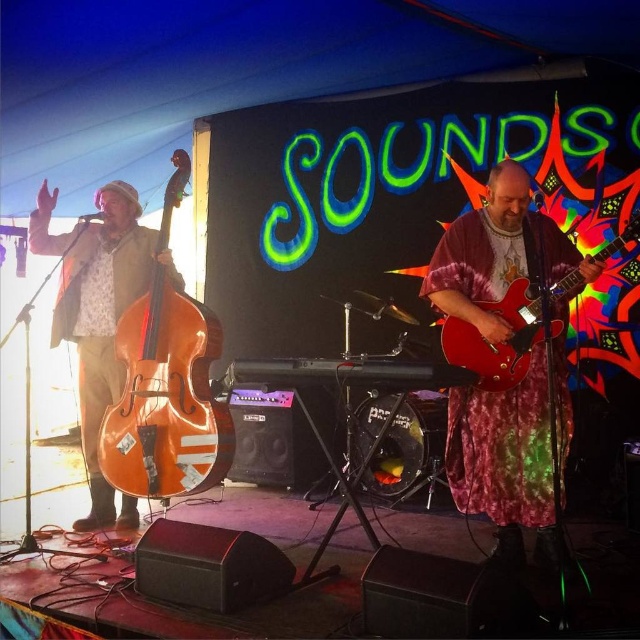
Who is positioned more to the right, shiny red guitar at center or glossy wood guitar at center?

glossy wood guitar at center

Which is behind, point (467, 301) or point (529, 355)?

The point (467, 301) is more distant.

Find the location of a particular element. shiny red guitar at center is located at coordinates (504, 460).

Can you confirm if shiny red guitar at center is taller than matte brown double bass at left?

No, shiny red guitar at center is not taller than matte brown double bass at left.

Between shiny red guitar at center and matte brown double bass at left, which one appears on the right side from the viewer's perspective?

From the viewer's perspective, shiny red guitar at center appears more on the right side.

Where is `shiny red guitar at center`? shiny red guitar at center is located at coordinates (504, 460).

Which of these two, shiny red guitar at center or natural wood bass at left, stands taller?

shiny red guitar at center is taller.

Between point (600, 264) and point (177, 422), which one is positioned behind?

The point (177, 422) is more distant.

This screenshot has height=640, width=640. Identify the location of shiny red guitar at center. (504, 460).

Where is `shiny red guitar at center`? This screenshot has height=640, width=640. shiny red guitar at center is located at coordinates (504, 460).